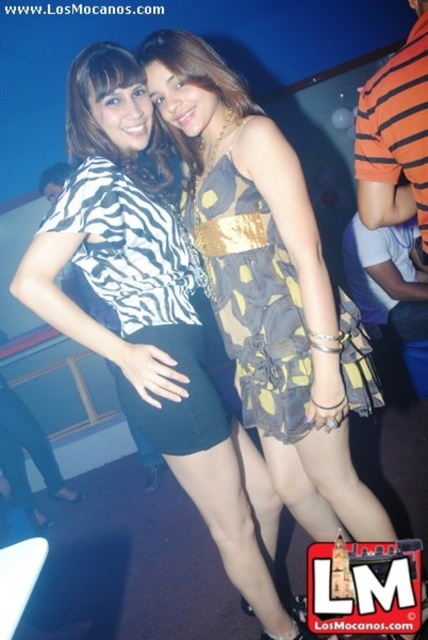
The image size is (428, 640). What do you see at coordinates (270, 288) in the screenshot?
I see `yellow dotted dress at center` at bounding box center [270, 288].

Between yellow dotted dress at center and zebra print fabric dress at center, which one has less height?

With less height is zebra print fabric dress at center.

Where is `yellow dotted dress at center`? yellow dotted dress at center is located at coordinates coord(270,288).

Is zebra print blouse at center behind printed fabric dress at center?

No.

Measure the distance between point (172, 348) and camera.

1.50 meters

What do you see at coordinates (151, 316) in the screenshot?
I see `zebra print blouse at center` at bounding box center [151, 316].

This screenshot has width=428, height=640. What are the coordinates of `zebra print blouse at center` in the screenshot? It's located at (151, 316).

Does yellow dotted dress at center appear under zebra print blouse at center?

Incorrect, yellow dotted dress at center is not positioned below zebra print blouse at center.

Based on the photo, can you confirm if yellow dotted dress at center is positioned above zebra print blouse at center?

Yes, yellow dotted dress at center is above zebra print blouse at center.

Who is more forward, (267, 273) or (190, 424)?

Point (190, 424)

Locate an element on the screen. Image resolution: width=428 pixels, height=640 pixels. yellow dotted dress at center is located at coordinates (270, 288).